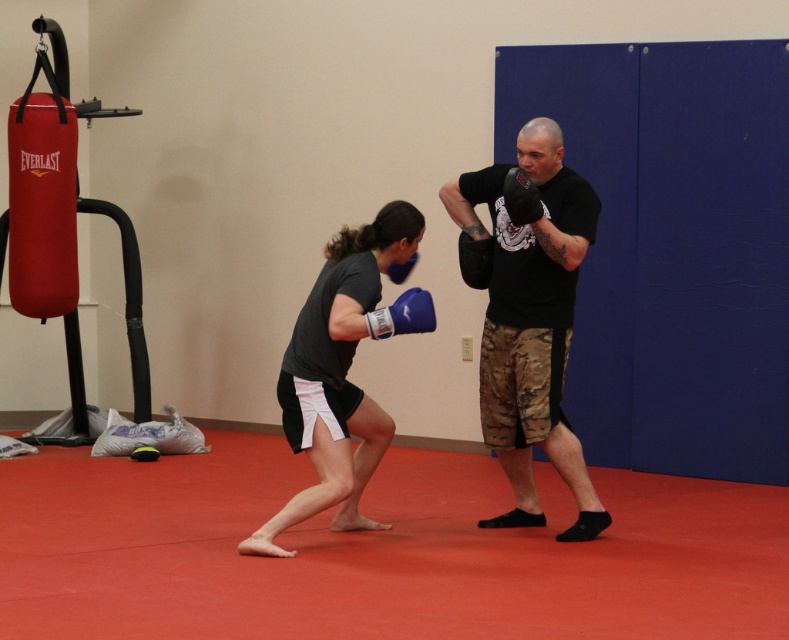
Question: Which object appears farthest from the camera in this image?

Choices:
 (A) black matte t-shirt at center
 (B) matte blue boxing glove at center
 (C) blue synthetic boxing glove at center

Answer: (A)

Question: Which point is closer to the camera taking this photo?

Choices:
 (A) (543, 184)
 (B) (346, 285)

Answer: (B)

Question: Is matte blue boxing glove at center closer to the viewer compared to blue synthetic boxing glove at center?

Choices:
 (A) no
 (B) yes

Answer: (A)

Question: Can you confirm if matte blue boxing glove at center is thinner than blue synthetic boxing glove at center?

Choices:
 (A) no
 (B) yes

Answer: (A)

Question: Which object is closer to the camera taking this photo?

Choices:
 (A) blue synthetic boxing glove at center
 (B) matte blue boxing glove at center

Answer: (A)

Question: Is black matte t-shirt at center above blue synthetic boxing glove at center?

Choices:
 (A) no
 (B) yes

Answer: (A)